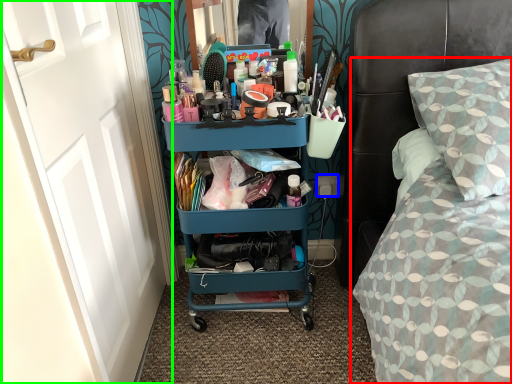
Question: Which object is positioned farthest from bed (highlighted by a red box)? Select from power outlet (highlighted by a blue box) and door (highlighted by a green box).

Choices:
 (A) power outlet
 (B) door

Answer: (B)